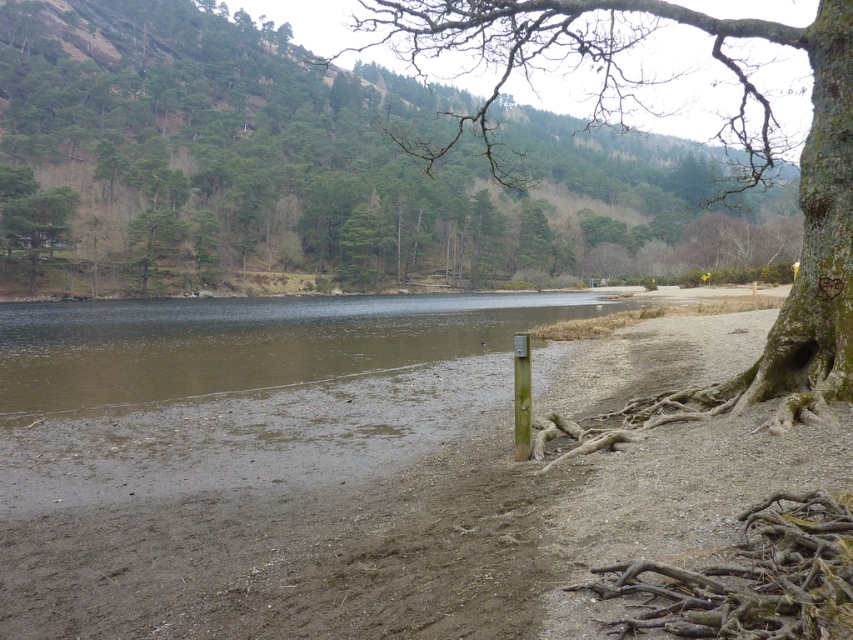
Question: Where is bark textured tree at center right located in relation to brown/muddy water at center in the image?

Choices:
 (A) below
 (B) above

Answer: (B)

Question: Which of the following is the closest to the observer?

Choices:
 (A) (791, 36)
 (B) (781, 509)

Answer: (B)

Question: Is bark textured tree at upper right thinner than bark textured tree at center right?

Choices:
 (A) no
 (B) yes

Answer: (A)

Question: Which point appears closest to the camera in this image?

Choices:
 (A) (526, 420)
 (B) (0, 321)
 (C) (775, 497)
 (D) (409, 248)

Answer: (C)

Question: Which object appears farthest from the camera in this image?

Choices:
 (A) bark textured tree at center right
 (B) brown rough tree roots at lower right
 (C) green metallic pole at center
 (D) bark textured tree at upper right

Answer: (D)

Question: Can you confirm if brown/muddy water at center is thinner than brown rough tree roots at lower right?

Choices:
 (A) yes
 (B) no

Answer: (B)